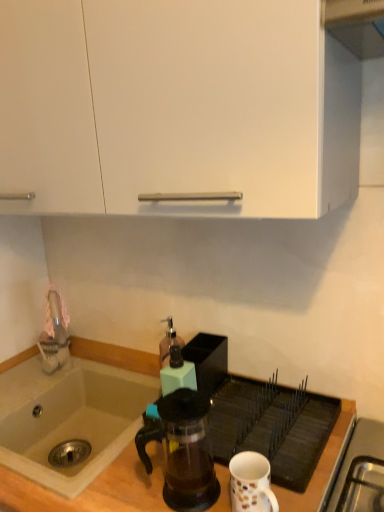
The height and width of the screenshot is (512, 384). I want to click on vacant space in front of matte plastic soap dispenser at center, the 2th kitchen appliance in the back-to-front sequence, so click(201, 444).